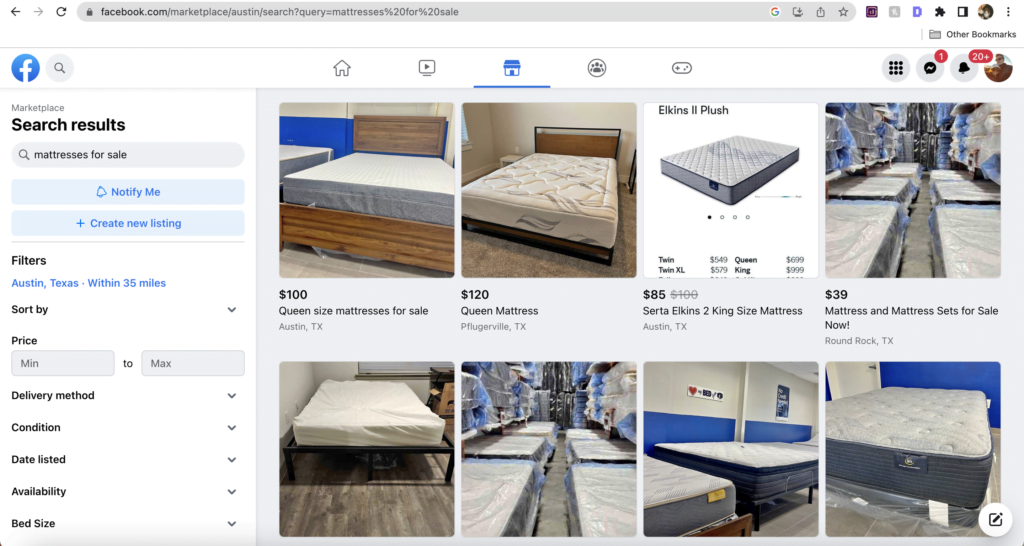
Image resolution: width=1024 pixels, height=546 pixels. What are the coordinates of `footboards` in the screenshot? It's located at (376, 240), (735, 520).